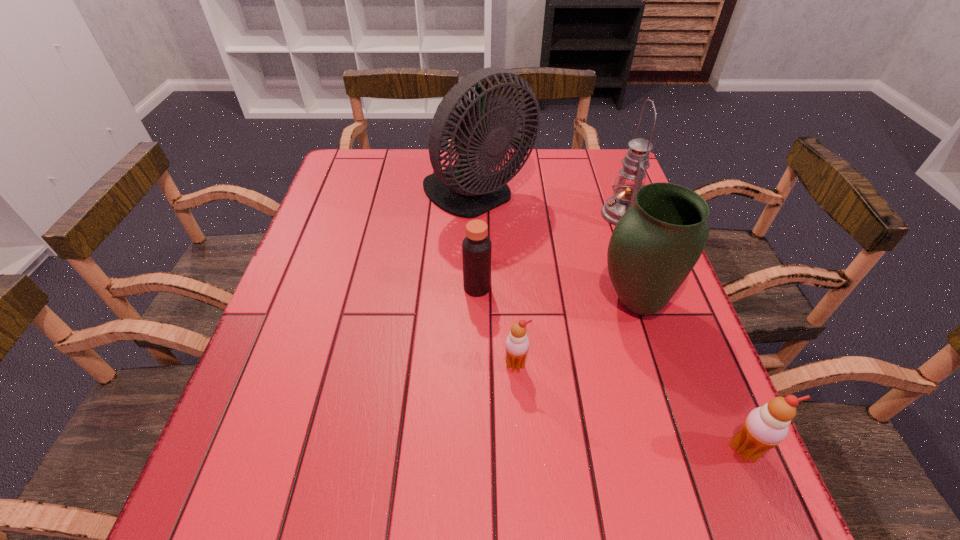
You are a GUI agent. You are given a task and a screenshot of the screen. Output one action in this format:
    pyautogui.click(x=<x>, y=<y>)
    Task: Click on the vacant area located 0.230m on the back of the vase
    This screenshot has height=540, width=960.
    Given the screenshot: What is the action you would take?
    pyautogui.click(x=609, y=219)

I want to click on free space located 0.150m on the front of the oil lamp, so click(x=641, y=272).

Identify the location of vacant space located 0.330m on the back of the vinegar. Image resolution: width=960 pixels, height=540 pixels. (478, 195).

What are the coordinates of `object that is at the far edge` in the screenshot? It's located at coord(468,189).

The image size is (960, 540). In order to click on object at the near edge in this screenshot , I will do `click(765, 427)`.

Find the location of a particular element. Image resolution: width=960 pixels, height=540 pixels. icecream at the right edge is located at coordinates (765, 427).

Find the location of `vase at the right edge`. vase at the right edge is located at coordinates (654, 246).

Where is `oil lamp that is at the right edge`? This screenshot has height=540, width=960. oil lamp that is at the right edge is located at coordinates point(631,177).

Where is `object that is at the near right corner`? object that is at the near right corner is located at coordinates (765, 427).

Where is `vacant area at the near edge`? vacant area at the near edge is located at coordinates (582, 430).